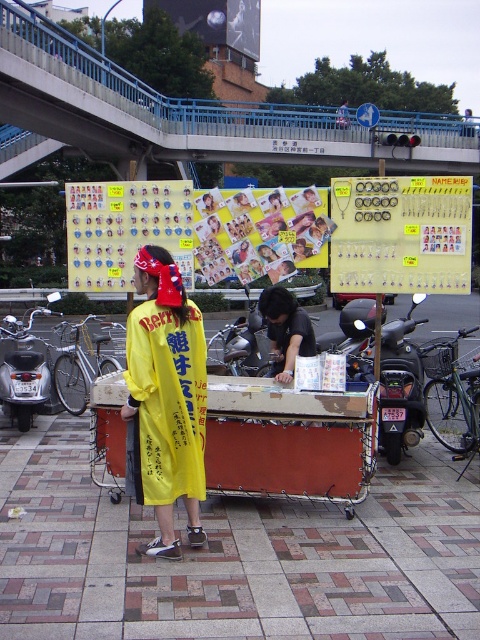
Question: Is the position of concrete bridge at upper center more distant than that of metallic cart at center?

Choices:
 (A) yes
 (B) no

Answer: (A)

Question: Does metallic cart at center have a larger size compared to black matte motorcycle at center?

Choices:
 (A) no
 (B) yes

Answer: (B)

Question: Which object is positioned farthest from the concrete bridge at upper center?

Choices:
 (A) black matte motorcycle at center
 (B) yellow fabric shirt at center

Answer: (A)

Question: Which object is positioned closest to the black matte motorcycle at center?

Choices:
 (A) yellow fabric shirt at center
 (B) silver metallic motorcycle at left
 (C) brick pavement at center
 (D) metallic cart at center

Answer: (D)

Question: Does concrete bridge at upper center have a smaller size compared to black matte motorcycle at center?

Choices:
 (A) yes
 (B) no

Answer: (B)

Question: Which of these objects is positioned closest to the black matte motorcycle at center?

Choices:
 (A) silver metallic motorcycle at left
 (B) brick pavement at center
 (C) concrete bridge at upper center

Answer: (B)